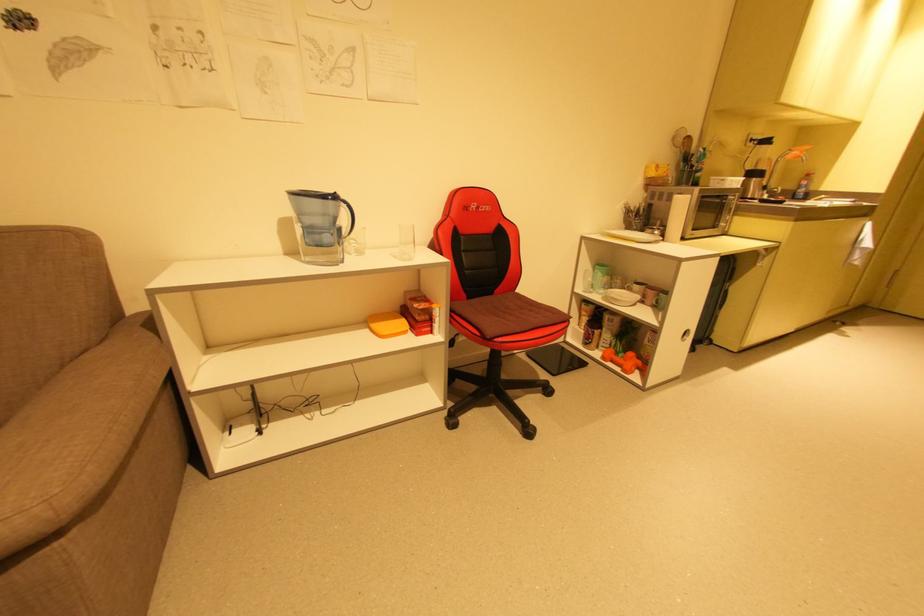
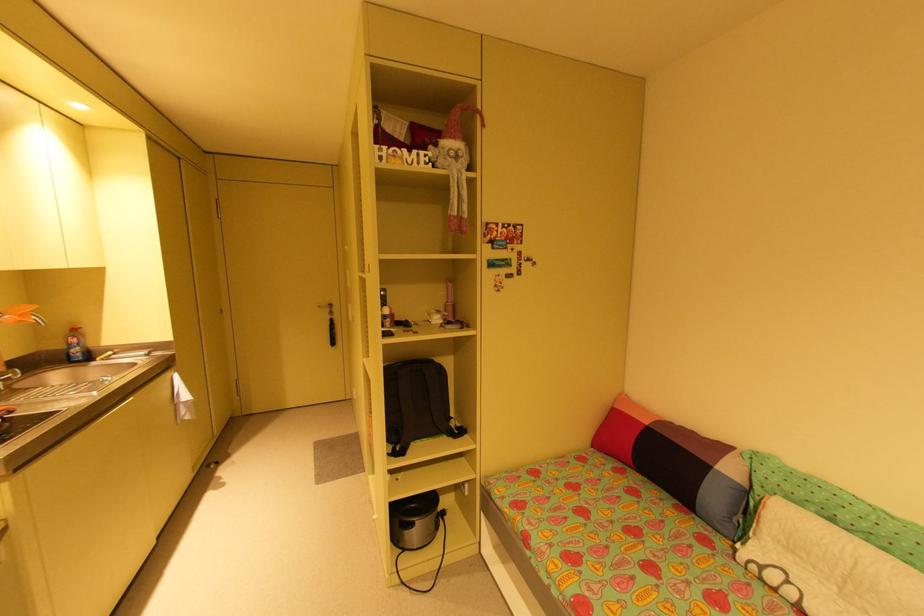
The point at (x=805, y=152) is marked in the first image. Where is the corresponding point in the second image?

(25, 315)